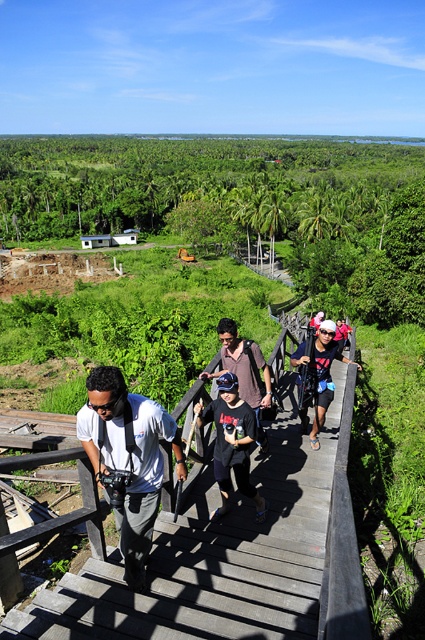
Does black matte t-shirt at center have a greater height compared to matte black backpack at center?

Incorrect, black matte t-shirt at center's height is not larger of matte black backpack at center's.

Find the location of a particular element. The width and height of the screenshot is (425, 640). black matte t-shirt at center is located at coordinates (232, 442).

Which is more to the right, white matte shirt at center or black matte t-shirt at center?

black matte t-shirt at center

Which of these two, white matte shirt at center or black matte t-shirt at center, stands taller?

With more height is white matte shirt at center.

The width and height of the screenshot is (425, 640). What do you see at coordinates (129, 458) in the screenshot?
I see `white matte shirt at center` at bounding box center [129, 458].

The height and width of the screenshot is (640, 425). I want to click on white matte shirt at center, so click(129, 458).

Between point (345, 424) and point (136, 432), which one is positioned in front?

Positioned in front is point (136, 432).

Is wooden bridge at center taller than white matte shirt at center?

No, wooden bridge at center is not taller than white matte shirt at center.

What do you see at coordinates (234, 557) in the screenshot? This screenshot has width=425, height=640. I see `wooden bridge at center` at bounding box center [234, 557].

I want to click on wooden bridge at center, so click(x=234, y=557).